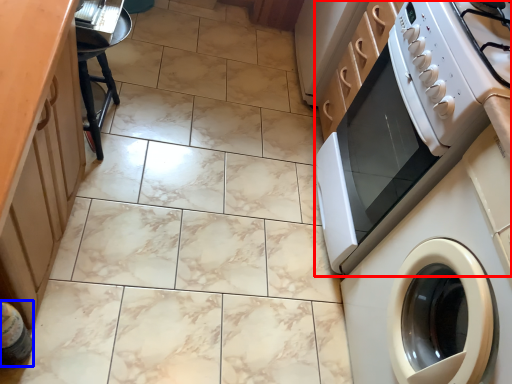
Question: Which of the following is the closest to the observer, home appliance (highlighted by a red box) or bottle (highlighted by a blue box)?

Choices:
 (A) home appliance
 (B) bottle

Answer: (B)